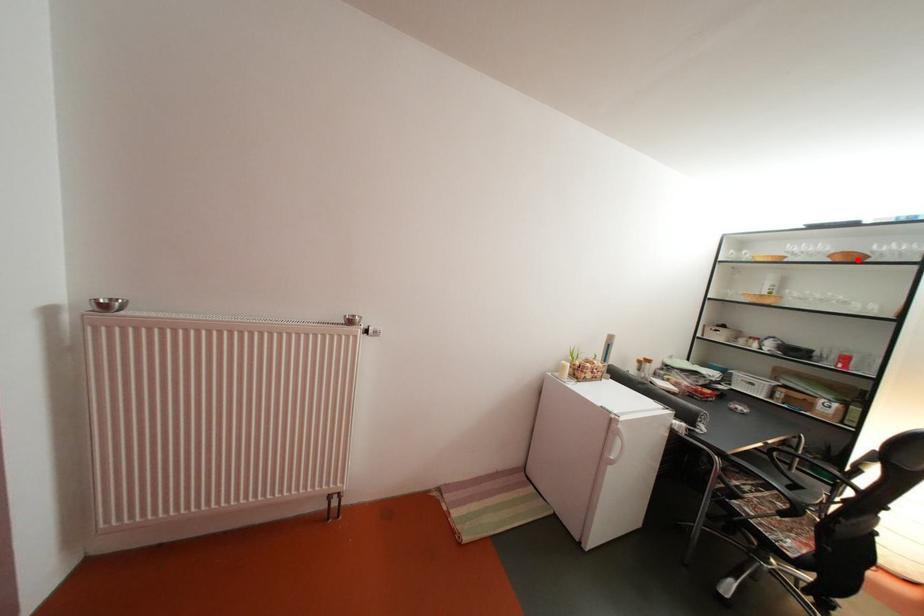
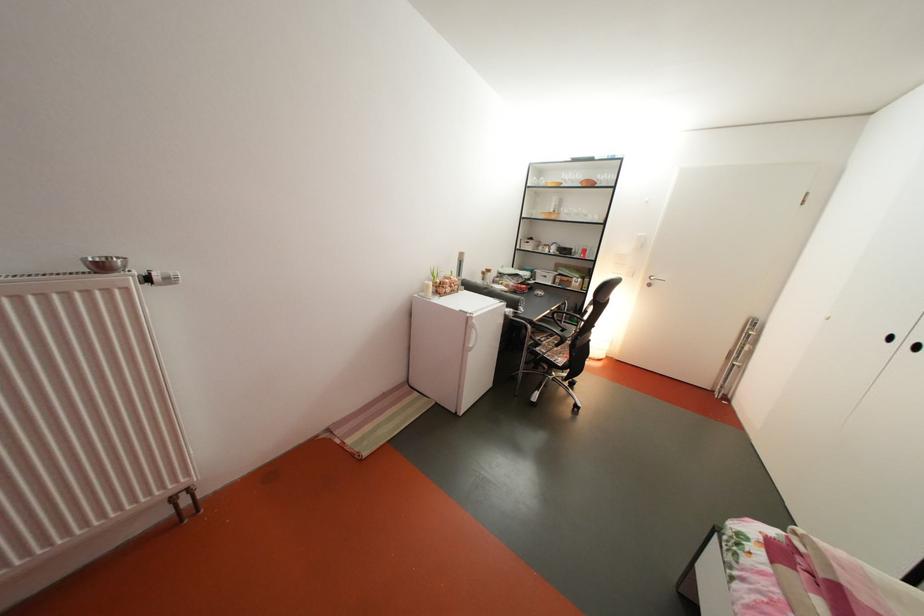
Find the pixel in the second image that matches the highlighted location in the first image.

(600, 187)